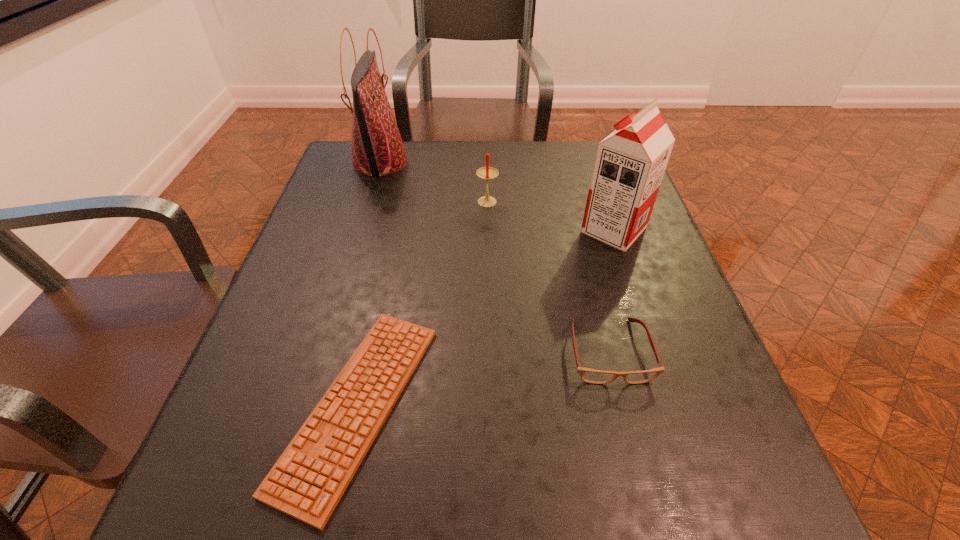
What are the coordinates of `vacant area that lies between the spectacles and the candle` in the screenshot? It's located at (548, 278).

Image resolution: width=960 pixels, height=540 pixels. What are the coordinates of `free spot between the computer keyboard and the soya milk` in the screenshot? It's located at (486, 317).

At what (x,y) coordinates should I click in order to perform the action: click on free area in between the handbag and the candle. Please return your answer as a coordinate pair (x, y). The height and width of the screenshot is (540, 960). Looking at the image, I should click on (434, 183).

This screenshot has height=540, width=960. In order to click on free space between the third shortest object and the second shortest object in this screenshot , I will do `click(548, 278)`.

The width and height of the screenshot is (960, 540). Find the location of `vacant area that lies between the spectacles and the shortest object`. vacant area that lies between the spectacles and the shortest object is located at coordinates (483, 378).

Where is `free space between the spectacles and the fourth shortest object`? free space between the spectacles and the fourth shortest object is located at coordinates (612, 291).

Locate which object ranks fourth in proximity to the farthest object. Please provide its 2D coordinates. Your answer should be formatted as a tuple, i.e. [(x, y)], where the tuple contains the x and y coordinates of a point satisfying the conditions above.

[(588, 375)]

Choose which object is the third nearest neighbor to the third object from right to left. Please provide its 2D coordinates. Your answer should be formatted as a tuple, i.e. [(x, y)], where the tuple contains the x and y coordinates of a point satisfying the conditions above.

[(308, 480)]

Find the location of a particular element. The height and width of the screenshot is (540, 960). free region that satisfies the following two spatial constraints: 1. on the back side of the shortest object; 2. on the right side of the candle is located at coordinates (401, 204).